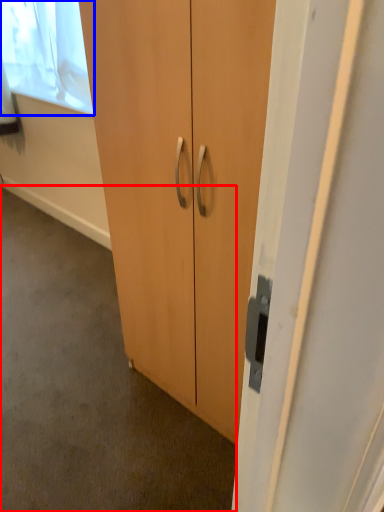
Question: Which point is closer to the camera, concrete (highlighted by a red box) or window screen (highlighted by a blue box)?

Choices:
 (A) concrete
 (B) window screen

Answer: (A)